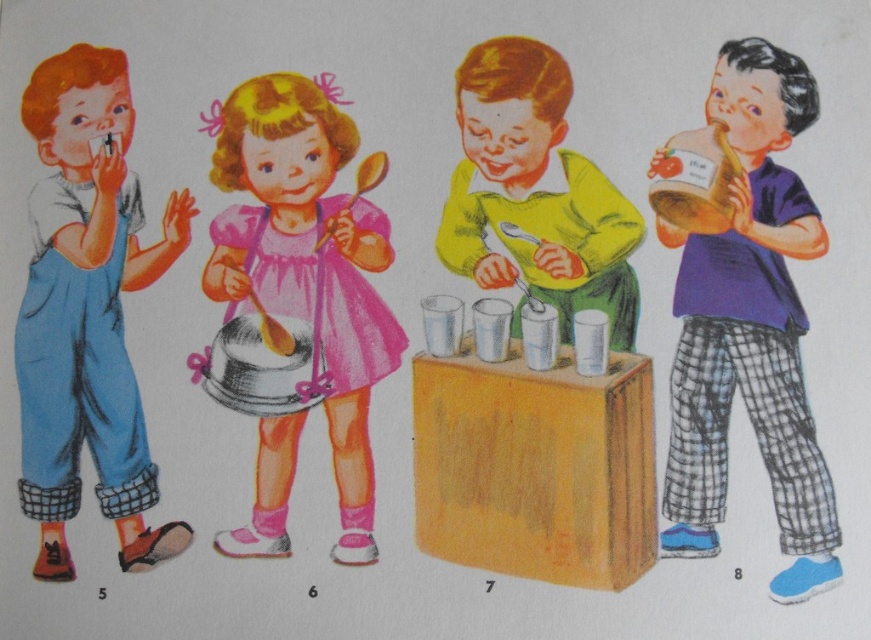
You are a parent trying to choose a shirt for your child. You have two options in the image, the purple cotton shirt at right and the matte blue overalls at left. Which one is bigger?

The purple cotton shirt at right is larger than the matte blue overalls at left according to the description.